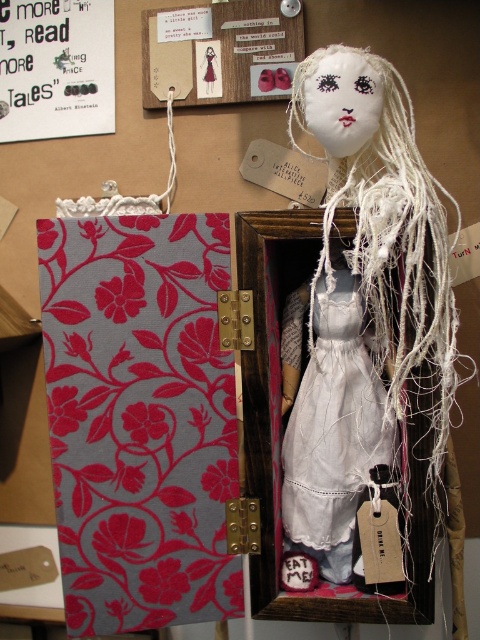
You are organizing a small display case and need to know if both the floral fabric book at center and the white fabric doll at center can fit side by side without overlapping. Based on their sizes, what do you think?

The floral fabric book at center occupies less space than the white fabric doll at center, so both items can fit side by side in the display case without overlapping.

You are a collector of miniature dolls and you have a display case that can only accommodate items up to 15 centimeters in height. You see the white fabric doll at center and the white cotton dress at center in the image. Can both items fit in the display case if placed separately?

The white fabric doll at center is much taller than the white cotton dress at center. Since the display case has a height limit of 15 centimeters, you need to check each item individually. However, the exact heights are not provided, so it is impossible to determine if both will fit without additional information.